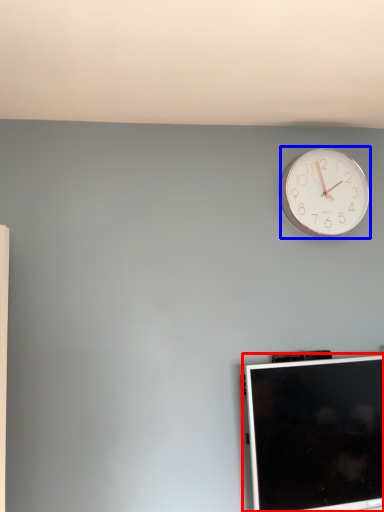
Question: Which of the following is the closest to the observer, computer monitor (highlighted by a red box) or wall clock (highlighted by a blue box)?

Choices:
 (A) computer monitor
 (B) wall clock

Answer: (A)